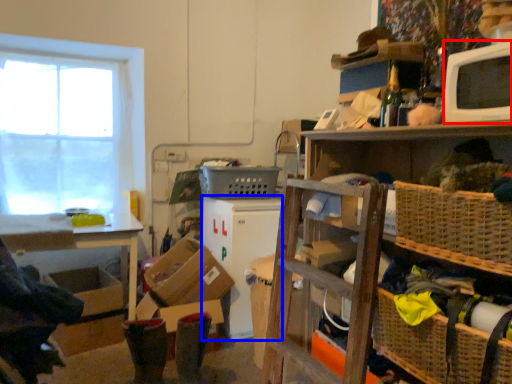
Question: Which of the following is the closest to the observer, appliance (highlighted by a red box) or appliance (highlighted by a blue box)?

Choices:
 (A) appliance
 (B) appliance

Answer: (A)